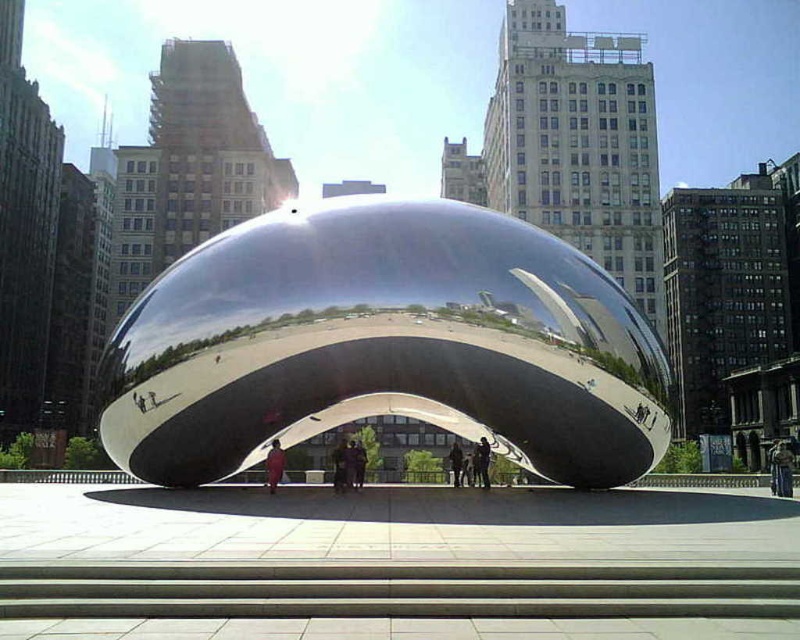
Question: Which of the following is the closest to the observer?

Choices:
 (A) (268, 470)
 (B) (480, 436)

Answer: (B)

Question: Is dark blue fabric at center thinner than dark gray fabric jacket at center?

Choices:
 (A) no
 (B) yes

Answer: (B)

Question: Is red fabric coat at center bigger than dark gray fabric jacket at center?

Choices:
 (A) no
 (B) yes

Answer: (A)

Question: Can you confirm if red fabric coat at center is positioned below dark blue fabric at center?

Choices:
 (A) no
 (B) yes

Answer: (B)

Question: Which point is farther to the camera?

Choices:
 (A) (284, 451)
 (B) (488, 454)
 (C) (452, 465)

Answer: (C)

Question: Which is farther from the dark gray fabric jacket at center?

Choices:
 (A) dark blue fabric at center
 (B) red fabric coat at center

Answer: (B)